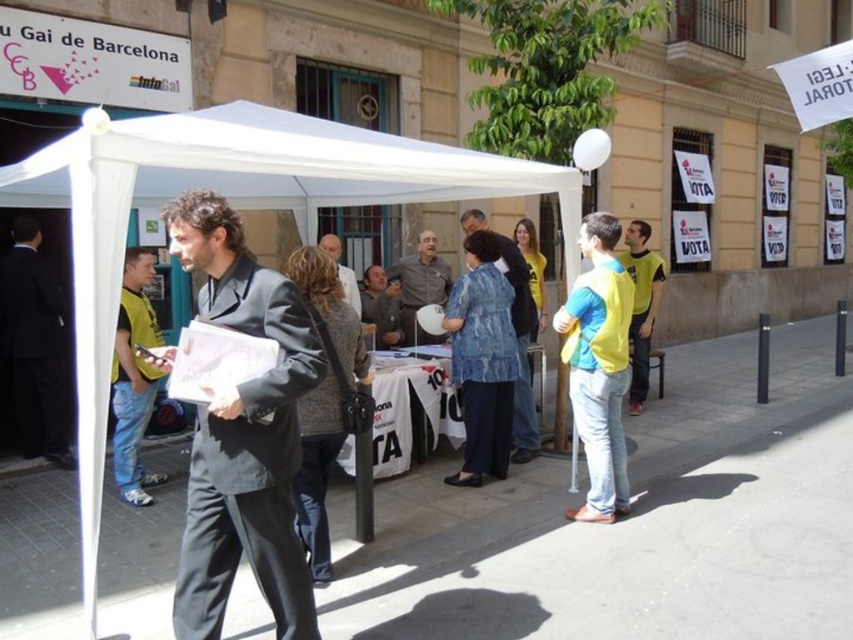
You are organizing a clothing donation drive and need to decide which jacket to place in a small donation box. Given the denim jacket at center and the light brown leather jacket at center, which jacket would not fit if the box can only accommodate the smaller jacket?

The light brown leather jacket at center would not fit in the donation box since it is the smaller jacket and the denim jacket at center is larger in size.

You are standing in front of the white canopy tent at the event. There are two points marked in the image. One is at coordinates point (485,228) and the other is at point (347,273). Which point is closer to you?

Point (485,228) is closer to the camera than point (347,273), so the point at coordinates point (485,228) is closer to you.

You are a photographer trying to capture a closeup of the dark gray shirt at center and the light brown leather jacket at center. Which one is closer to the camera?

The dark gray shirt at center is positioned under the light brown leather jacket at center, so the light brown leather jacket at center is closer to the camera.